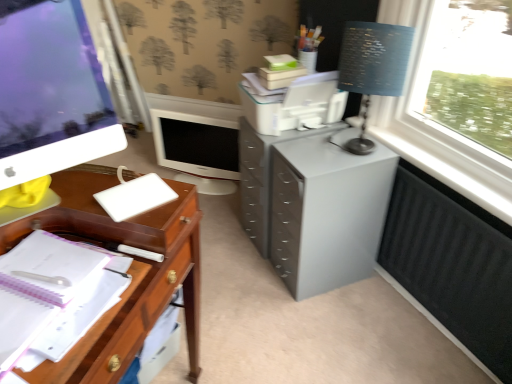
Question: From a real-world perspective, relative to blue fabric lampshade at upper right, is white matte notebook at left vertically above or below?

Choices:
 (A) above
 (B) below

Answer: (B)

Question: In the image, is white matte notebook at left positioned in front of or behind blue fabric lampshade at upper right?

Choices:
 (A) behind
 (B) front

Answer: (B)

Question: Which object is the farthest from the white plastic pen at left?

Choices:
 (A) blue fabric lampshade at upper right
 (B) white glossy computer monitor at center, the second computer monitor positioned from the front
 (C) white glossy computer monitor at left, placed as the 1th computer monitor when sorted from front to back
 (D) black matte radiator at lower right
 (E) white matte notebook at left

Answer: (B)

Question: Estimate the real-world distances between objects in this image. Which object is closer to the blue fabric lampshade at upper right?

Choices:
 (A) white matte notebook at left
 (B) gray matte filing cabinet at center-right
 (C) black matte radiator at lower right
 (D) white glossy computer monitor at center, which is the 1th computer monitor in back-to-front order
 (E) white plastic pen at left

Answer: (B)